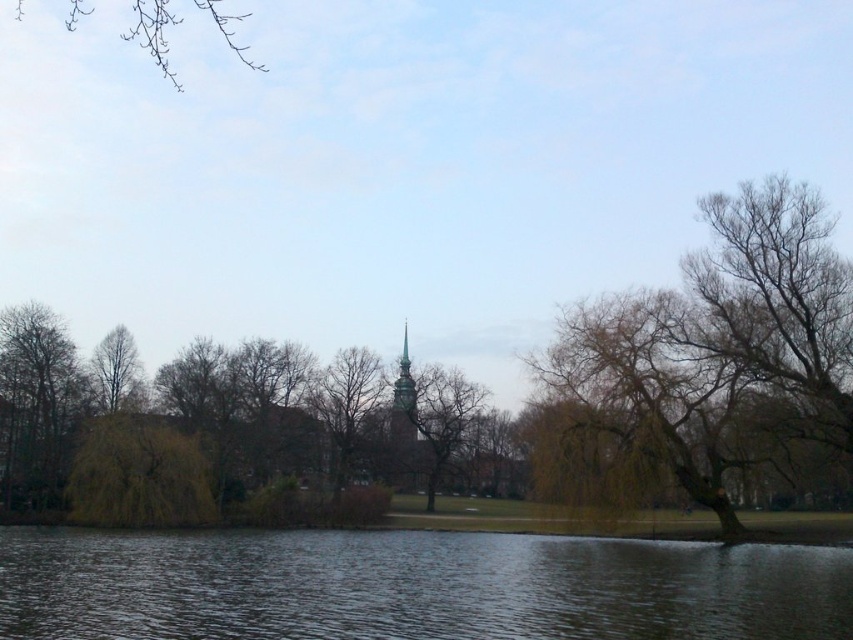
You are standing in the scene and want to walk from the dark water at lower center to the brown textured tree at center. Which direction should you move to get closer to the tree?

Since the dark water at lower center is closer to the viewer than the brown textured tree at center, you should move forward towards the tree to get closer to it.

You are standing in the serene outdoor scene and want to walk from the green matte tree at left to the dark water at lower center. Which direction should you head?

You should head to the right to reach the dark water at lower center from the green matte tree at left, as the dark water at lower center is located to the right of the green matte tree at left.

You are a photographer planning to capture the dark water at lower center and the brown textured tree at center in a single shot. Based on their sizes in the image, which object would appear wider in the photo?

The dark water at lower center would appear wider in the photo since its width is larger than that of the brown textured tree at center.